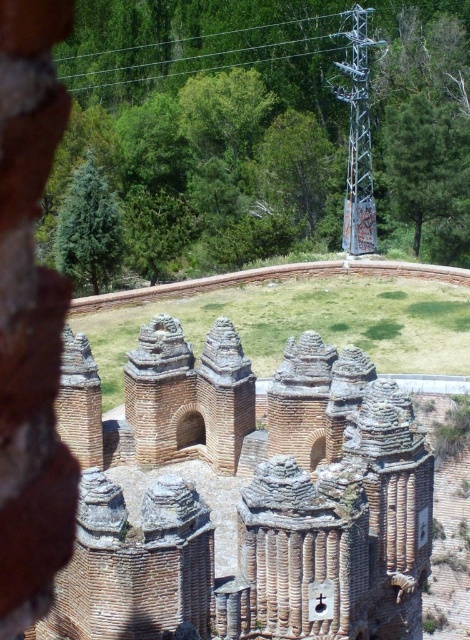
Question: Where is brown brick ruins at center located in relation to metallic wire at upper center in the image?

Choices:
 (A) below
 (B) above

Answer: (A)

Question: Which object is closer to the camera taking this photo?

Choices:
 (A) metallic/grey tower at upper right
 (B) brown brick ruins at center

Answer: (B)

Question: Which point is farther to the camera?

Choices:
 (A) (286, 44)
 (B) (329, 579)

Answer: (A)

Question: Is metallic/grey tower at upper right positioned at the back of metallic wire at upper center?

Choices:
 (A) no
 (B) yes

Answer: (A)

Question: Estimate the real-world distances between objects in this image. Which object is closer to the metallic wire at upper center?

Choices:
 (A) metallic/grey tower at upper right
 (B) brown brick ruins at center

Answer: (A)

Question: Is brown brick ruins at center to the right of metallic/grey tower at upper right from the viewer's perspective?

Choices:
 (A) no
 (B) yes

Answer: (A)